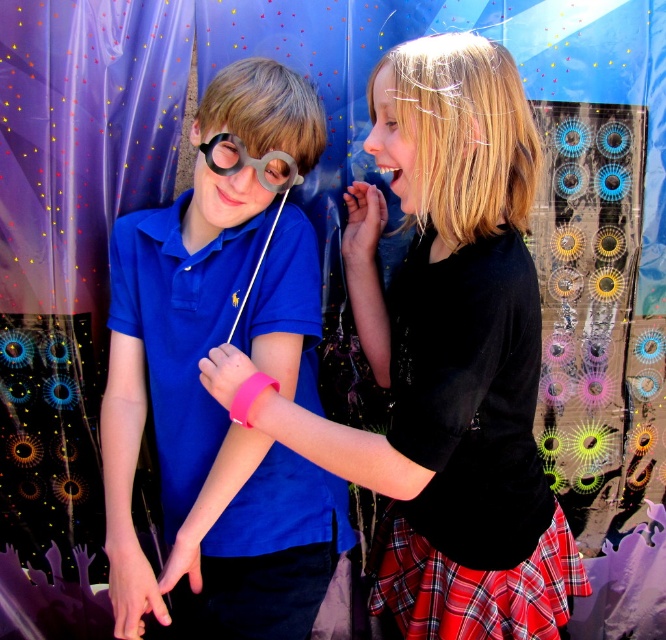
Question: Observing the image, what is the correct spatial positioning of blue matte shirt at center in reference to black paper at center?

Choices:
 (A) right
 (B) left

Answer: (B)

Question: Can you confirm if black matte dress at center is positioned to the right of black paper at center?

Choices:
 (A) no
 (B) yes

Answer: (B)

Question: Does black matte dress at center appear on the right side of black paper at center?

Choices:
 (A) yes
 (B) no

Answer: (A)

Question: Which point is farther from the camera taking this photo?

Choices:
 (A) (196, 282)
 (B) (278, 177)
 (C) (466, 228)

Answer: (A)

Question: Considering the real-world distances, which object is closest to the black paper at center?

Choices:
 (A) black matte dress at center
 (B) blue matte shirt at center

Answer: (B)

Question: Which point is farther to the camera?

Choices:
 (A) blue matte shirt at center
 (B) black paper at center

Answer: (A)